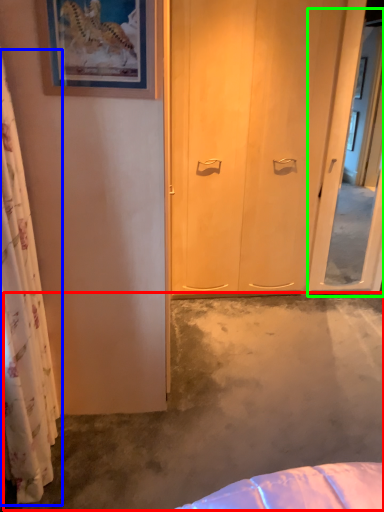
Question: Which is nearer to the concrete (highlighted by a red box)? curtain (highlighted by a blue box) or screen door (highlighted by a green box).

Choices:
 (A) curtain
 (B) screen door

Answer: (A)